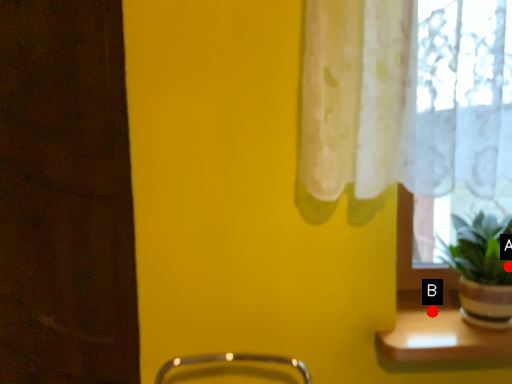
Question: Two points are circled on the image, labeled by A and B beside each circle. Which point is farther from the camera taking this photo?

Choices:
 (A) A is further
 (B) B is further

Answer: (B)